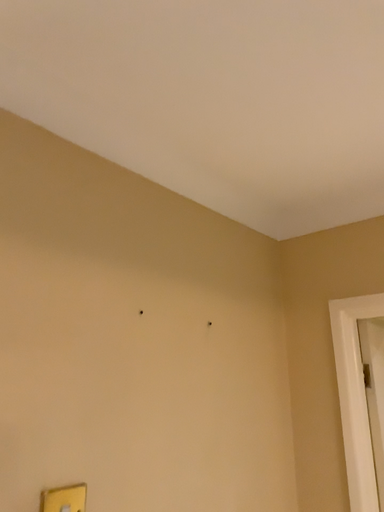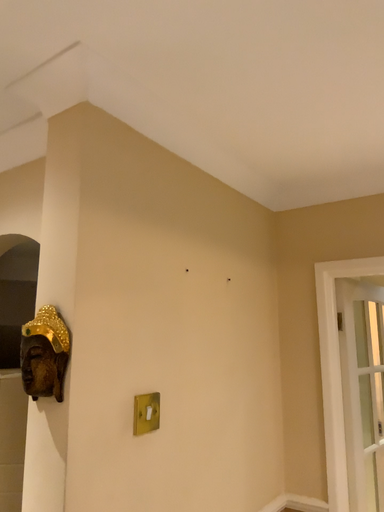
Question: Which way did the camera rotate in the video?

Choices:
 (A) rotated left
 (B) rotated right

Answer: (B)